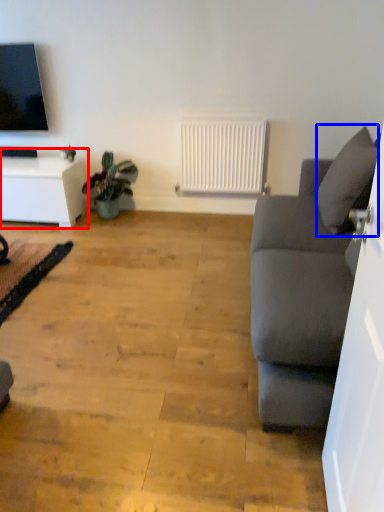
Question: Which point is closer to the camera, table (highlighted by a red box) or pillow (highlighted by a blue box)?

Choices:
 (A) table
 (B) pillow

Answer: (B)